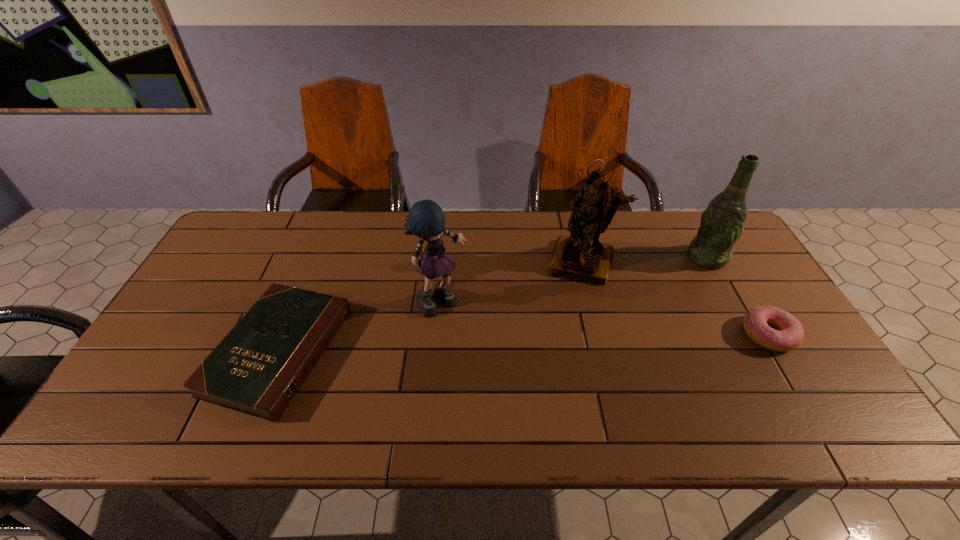
I want to click on doughnut that is at the right edge, so click(x=789, y=334).

The width and height of the screenshot is (960, 540). Identify the location of beer bottle that is at the right edge. (722, 223).

Find the location of `object located at the near left corner`. object located at the near left corner is located at coordinates (259, 366).

I want to click on object present at the far right corner, so click(x=722, y=223).

In the image, there is a desktop. Where is `vacant space at the far edge`? This screenshot has height=540, width=960. vacant space at the far edge is located at coordinates (630, 239).

This screenshot has width=960, height=540. In the image, there is a desktop. In order to click on vacant space at the near edge in this screenshot , I will do `click(515, 395)`.

Where is `vacant region at the left edge of the desktop`? The width and height of the screenshot is (960, 540). vacant region at the left edge of the desktop is located at coordinates (213, 302).

What are the coordinates of `free space at the right edge of the desktop` in the screenshot? It's located at 756,276.

Where is `vacant region at the far right corner of the desktop`? The height and width of the screenshot is (540, 960). vacant region at the far right corner of the desktop is located at coordinates (739, 248).

The height and width of the screenshot is (540, 960). Find the location of `vacant area between the beer bottle and the doughnut`. vacant area between the beer bottle and the doughnut is located at coordinates (737, 296).